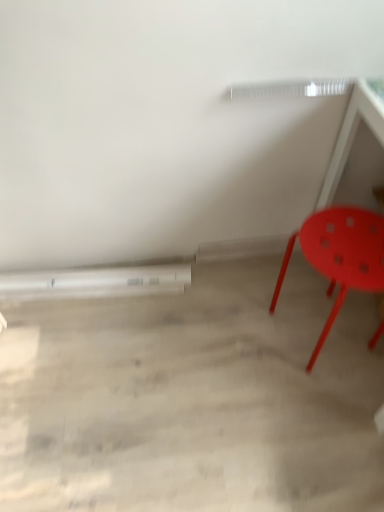
Where is `vacant space to the left of matte plastic chair at right`? vacant space to the left of matte plastic chair at right is located at coordinates (236, 329).